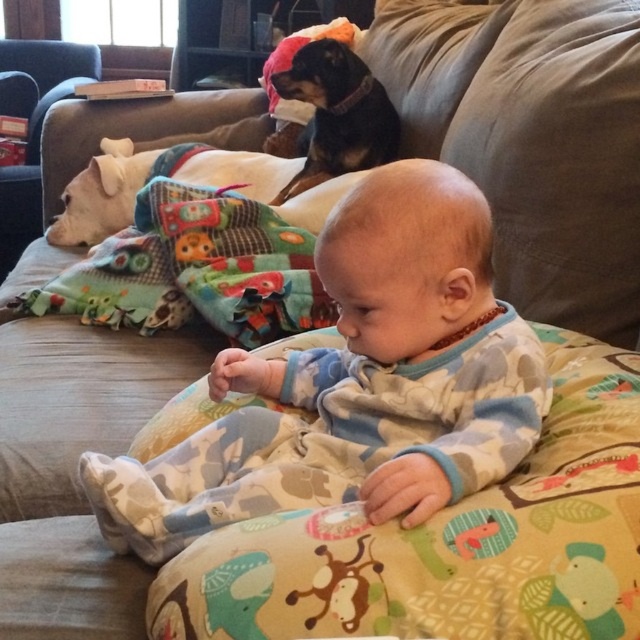
You are a photographer setting up a shoot in this room. You want to place a small prop exactly 0.1 units to the right of the multicolored fleece blanket at left. What are the coordinates where you should place the prop?

The coordinates to place the prop would be approximately at point (195, 333), since the original position of the multicolored fleece blanket at left is at point (195, 269). Moving 0.1 units to the right adds to the x coordinate, resulting in 0.423 plus 0.1 equals 0.523, keeping the y coordinate the same at 0.305.

You are a photographer setting up for a family photo. You need to ensure that the printed fabric baby at center and the black smooth dog at upper center are both in frame. Given their sizes, which one should you focus on first to ensure proper framing?

The printed fabric baby at center is larger in size compared to the black smooth dog at upper center, so you should focus on framing the baby first to accommodate its size, then adjust the frame to include the dog.

You are a parent trying to decide where to place a new toy. The toy is small enough to fit in the space taken by the printed fabric baby at center. Is there enough space to place it next to the multicolored fleece blanket at left?

The printed fabric baby at center occupies less space than the multicolored fleece blanket at left, so there is enough space to place the toy next to the multicolored fleece blanket at left.